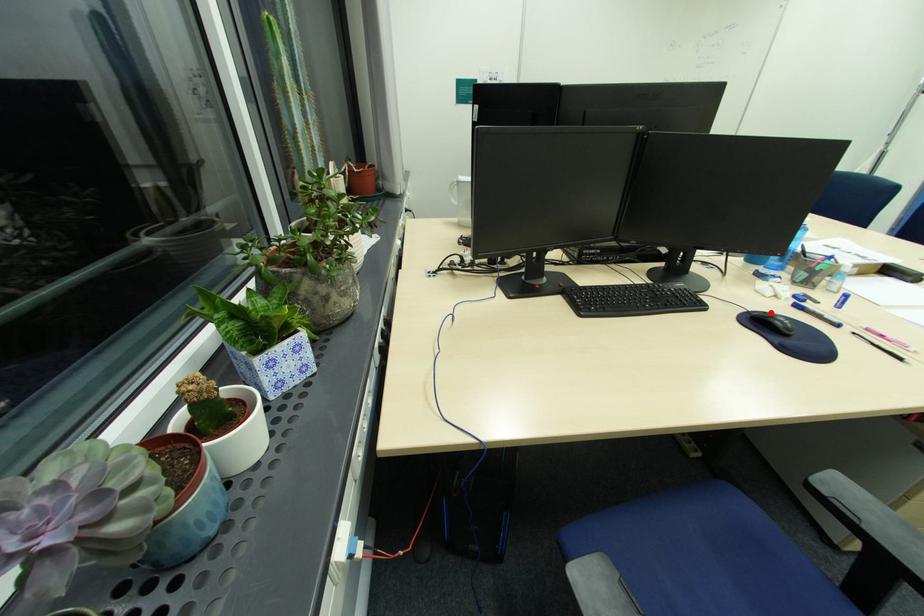
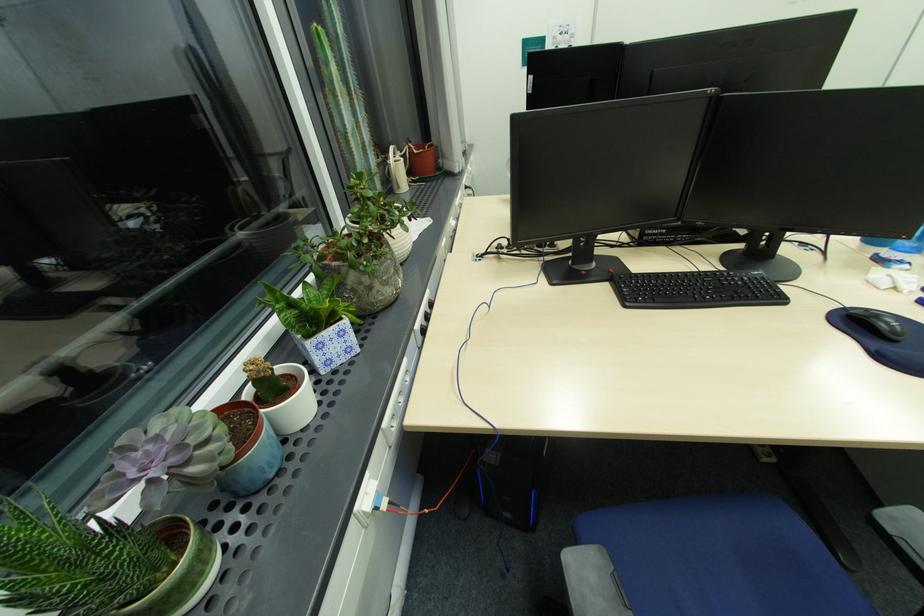
Find the pixel in the second image that matches the highlighted location in the first image.

(872, 310)